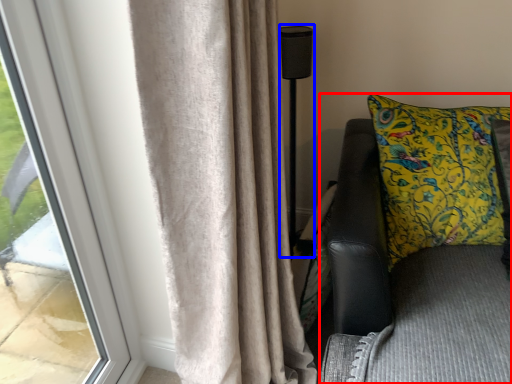
Question: Which object is further to the camera taking this photo, furniture (highlighted by a red box) or lamp (highlighted by a blue box)?

Choices:
 (A) furniture
 (B) lamp

Answer: (B)